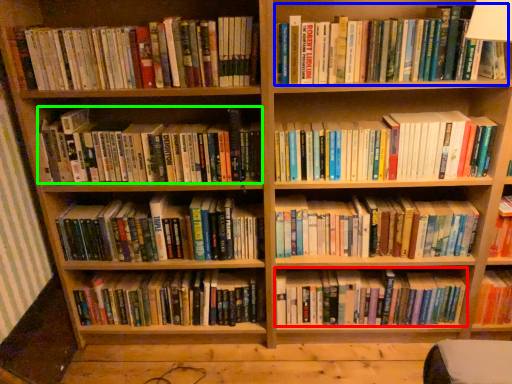
Question: Which is nearer to the book (highlighted by a red box)? book (highlighted by a blue box) or book (highlighted by a green box).

Choices:
 (A) book
 (B) book

Answer: (B)